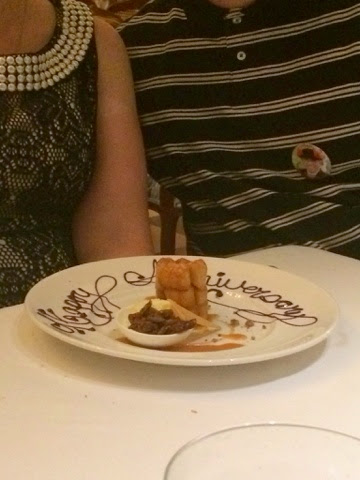
Find the location of a particular element. table is located at coordinates (120, 444).